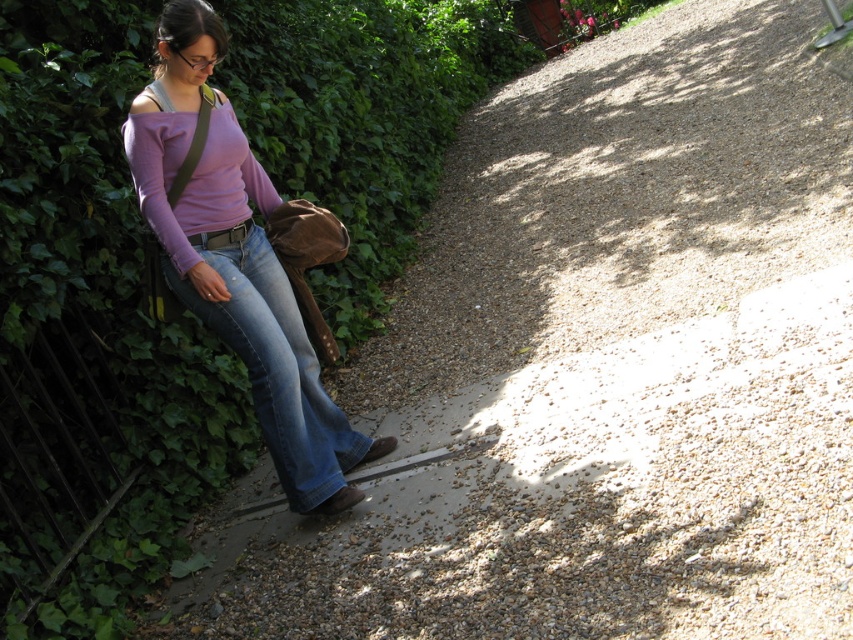
Question: Does denim jeans at left have a smaller size compared to blue denim jeans at left?

Choices:
 (A) yes
 (B) no

Answer: (B)

Question: Is denim jeans at left bigger than blue denim jeans at left?

Choices:
 (A) no
 (B) yes

Answer: (B)

Question: Which point is farther to the camera?

Choices:
 (A) blue denim jeans at left
 (B) denim jeans at left

Answer: (A)

Question: Does denim jeans at left have a larger size compared to blue denim jeans at left?

Choices:
 (A) no
 (B) yes

Answer: (B)